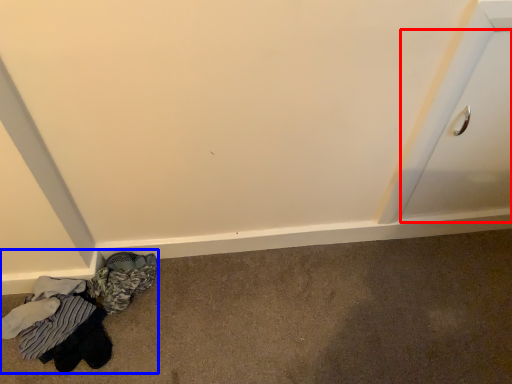
Question: Which of the following is the farthest to the observer, drawer (highlighted by a red box) or laundry (highlighted by a blue box)?

Choices:
 (A) drawer
 (B) laundry

Answer: (B)